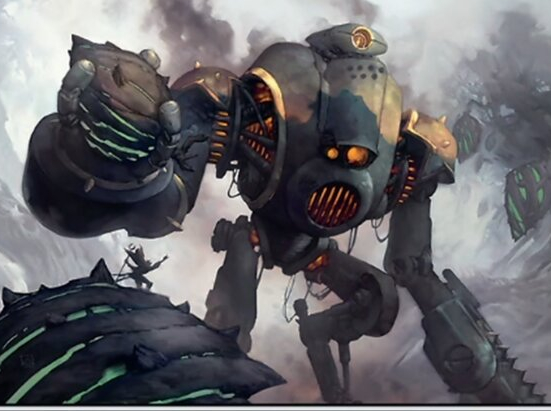
At what (x,y) coordinates should I click in order to perform the action: click on cable. Please return your answer as a coordinate pair (x, y). The height and width of the screenshot is (411, 551). Looking at the image, I should click on (230, 194), (234, 181), (354, 240), (349, 238), (378, 223), (379, 239), (315, 295), (287, 320), (289, 291), (262, 270).